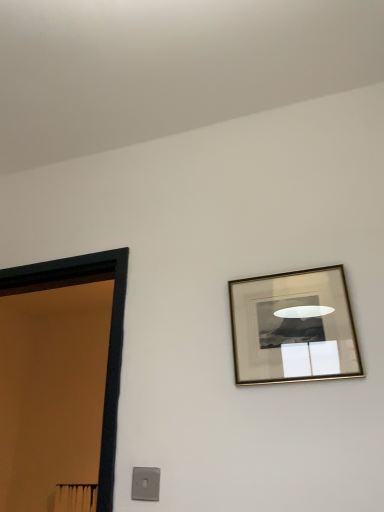
Question: Is satin silver switch at lower left surrounded by black wooden door at left?

Choices:
 (A) yes
 (B) no

Answer: (B)

Question: Can you confirm if black wooden door at left is wider than satin silver switch at lower left?

Choices:
 (A) yes
 (B) no

Answer: (A)

Question: Can you confirm if black wooden door at left is shorter than satin silver switch at lower left?

Choices:
 (A) yes
 (B) no

Answer: (B)

Question: Does black wooden door at left have a smaller size compared to satin silver switch at lower left?

Choices:
 (A) yes
 (B) no

Answer: (B)

Question: From the image's perspective, is black wooden door at left under satin silver switch at lower left?

Choices:
 (A) yes
 (B) no

Answer: (B)

Question: From the image's perspective, is black wooden door at left positioned above or below satin silver switch at lower left?

Choices:
 (A) above
 (B) below

Answer: (A)

Question: Would you say black wooden door at left is inside or outside satin silver switch at lower left?

Choices:
 (A) inside
 (B) outside

Answer: (B)

Question: Visually, is black wooden door at left positioned to the left or to the right of satin silver switch at lower left?

Choices:
 (A) right
 (B) left

Answer: (B)

Question: Considering their positions, is black wooden door at left located in front of or behind satin silver switch at lower left?

Choices:
 (A) behind
 (B) front

Answer: (A)

Question: Looking at their shapes, would you say satin silver switch at lower left is wider or thinner than gold metallic picture frame at upper right?

Choices:
 (A) thin
 (B) wide

Answer: (A)

Question: Considering the positions of point pos(144,499) and point pos(321,360), is point pos(144,499) closer or farther from the camera than point pos(321,360)?

Choices:
 (A) farther
 (B) closer

Answer: (A)

Question: Visually, is satin silver switch at lower left positioned to the left or to the right of gold metallic picture frame at upper right?

Choices:
 (A) right
 (B) left

Answer: (B)

Question: Considering the positions of satin silver switch at lower left and gold metallic picture frame at upper right in the image, is satin silver switch at lower left bigger or smaller than gold metallic picture frame at upper right?

Choices:
 (A) big
 (B) small

Answer: (B)

Question: Choose the correct answer: Is gold metallic picture frame at upper right inside satin silver switch at lower left or outside it?

Choices:
 (A) inside
 (B) outside

Answer: (B)

Question: From their relative heights in the image, would you say gold metallic picture frame at upper right is taller or shorter than satin silver switch at lower left?

Choices:
 (A) tall
 (B) short

Answer: (A)